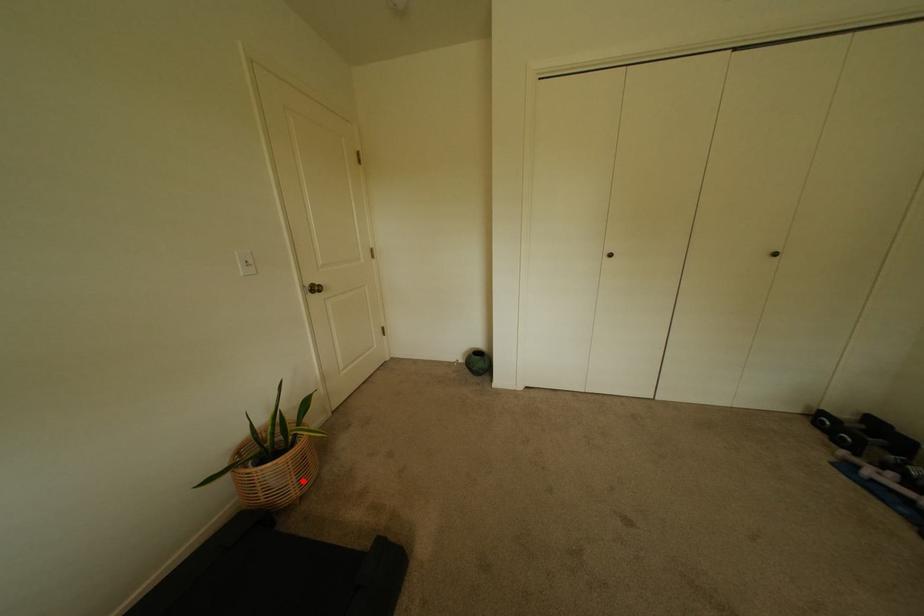
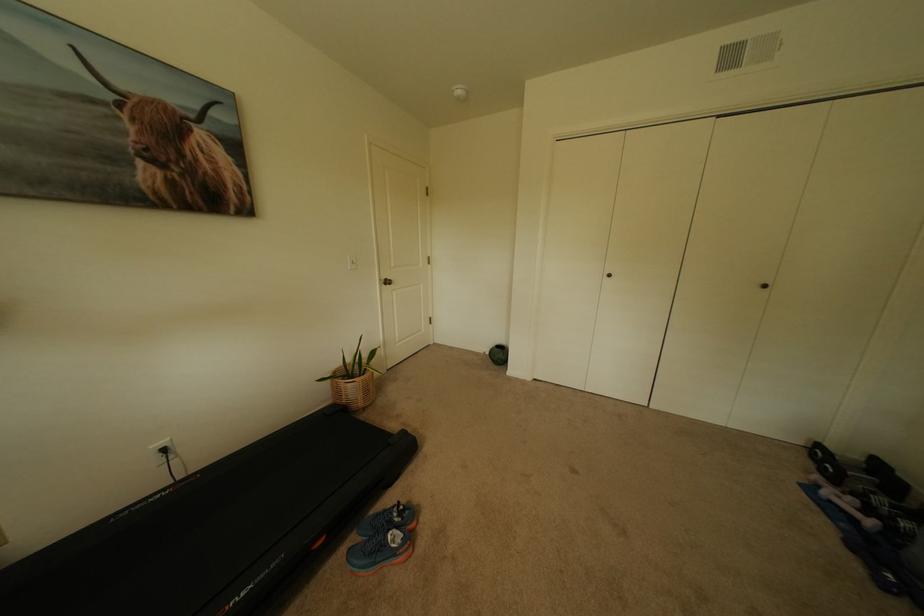
Locate, in the second image, the point that corresponds to the highlighted location in the first image.

(370, 395)